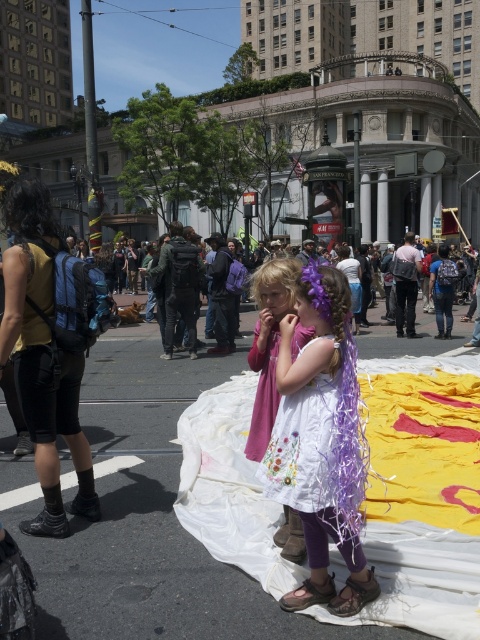
Is point (55, 490) positioned behind point (268, 426)?

Yes, it is.

Locate an element on the screen. yellow sleeveless top at left is located at coordinates (49, 348).

Does white satin dress at center have a greater width compared to white cotton dress at center?

Correct, the width of white satin dress at center exceeds that of white cotton dress at center.

Does white satin dress at center have a smaller size compared to white cotton dress at center?

No, white satin dress at center is not smaller than white cotton dress at center.

Identify the location of white satin dress at center. Image resolution: width=480 pixels, height=640 pixels. (322, 442).

The image size is (480, 640). Find the location of `white satin dress at center`. white satin dress at center is located at coordinates (322, 442).

Who is higher up, white satin dress at center or purple fabric dress at center?

purple fabric dress at center is above.

Between white satin dress at center and purple fabric dress at center, which one has more height?

With more height is white satin dress at center.

This screenshot has width=480, height=640. What are the coordinates of `white satin dress at center` in the screenshot? It's located at (322, 442).

In order to click on white satin dress at center in this screenshot , I will do `click(322, 442)`.